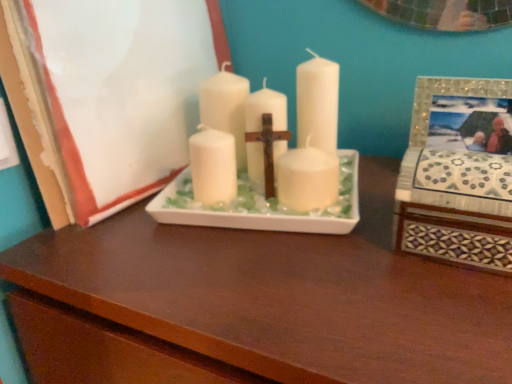
Where is `blank space to the left of mosaic tile picture frame at right, which is the second picture frame from left to right`? The image size is (512, 384). blank space to the left of mosaic tile picture frame at right, which is the second picture frame from left to right is located at coordinates (328, 276).